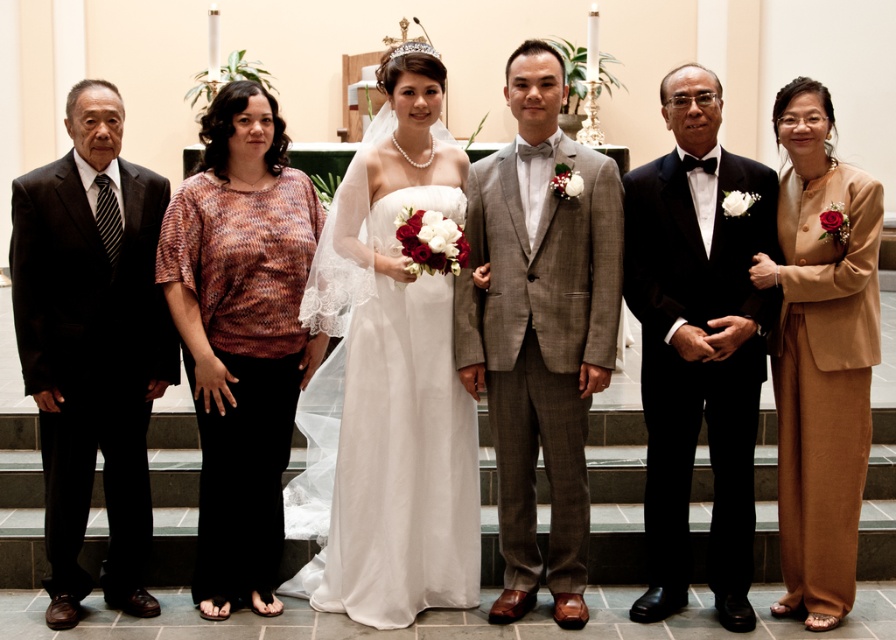
Which is in front, point (446, 369) or point (868, 326)?

Point (868, 326) is more forward.

The width and height of the screenshot is (896, 640). What do you see at coordinates (395, 374) in the screenshot?
I see `white satin dress at center` at bounding box center [395, 374].

Does point (386, 545) come behind point (830, 198)?

That is True.

In order to click on white satin dress at center in this screenshot , I will do 395,374.

Measure the distance between gray textured suit at center and black suit at left.

gray textured suit at center is 5.81 feet from black suit at left.

Can you confirm if gray textured suit at center is taller than black suit at left?

Indeed, gray textured suit at center has a greater height compared to black suit at left.

Which is in front, point (533, 115) or point (30, 348)?

Point (30, 348)

The width and height of the screenshot is (896, 640). Identify the location of gray textured suit at center. (540, 326).

Who is higher up, black suit at left or black satin tuxedo at center?

Positioned higher is black satin tuxedo at center.

Does black suit at left have a greater width compared to black satin tuxedo at center?

Yes.

Between point (162, 349) and point (714, 531), which one is positioned behind?

Point (162, 349)

I want to click on black suit at left, so click(92, 344).